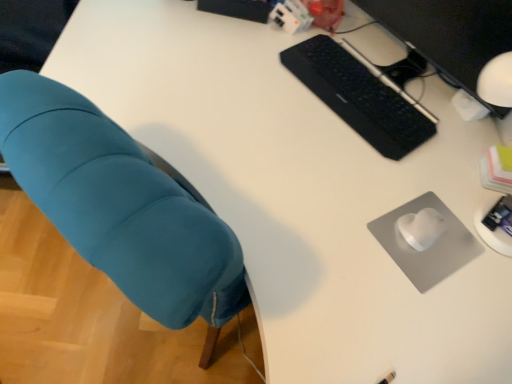
Question: Is black matte keyboard at upper right placed right next to black matte computer monitor at upper right?

Choices:
 (A) no
 (B) yes

Answer: (A)

Question: From the image's perspective, is black matte keyboard at upper right located above black matte computer monitor at upper right?

Choices:
 (A) yes
 (B) no

Answer: (B)

Question: Is black matte keyboard at upper right at the right side of black matte computer monitor at upper right?

Choices:
 (A) no
 (B) yes

Answer: (A)

Question: From the image's perspective, is black matte keyboard at upper right under black matte computer monitor at upper right?

Choices:
 (A) no
 (B) yes

Answer: (B)

Question: Is black matte keyboard at upper right oriented towards black matte computer monitor at upper right?

Choices:
 (A) no
 (B) yes

Answer: (A)

Question: Considering the relative sizes of black matte keyboard at upper right and black matte computer monitor at upper right in the image provided, is black matte keyboard at upper right wider than black matte computer monitor at upper right?

Choices:
 (A) yes
 (B) no

Answer: (A)

Question: Is black matte keyboard at upper right to the right of gray matte mousepad at lower right from the viewer's perspective?

Choices:
 (A) no
 (B) yes

Answer: (A)

Question: Can you confirm if black matte keyboard at upper right is thinner than gray matte mousepad at lower right?

Choices:
 (A) yes
 (B) no

Answer: (A)

Question: Is the surface of black matte keyboard at upper right in direct contact with gray matte mousepad at lower right?

Choices:
 (A) no
 (B) yes

Answer: (A)

Question: Is black matte keyboard at upper right outside of gray matte mousepad at lower right?

Choices:
 (A) yes
 (B) no

Answer: (A)

Question: From the image's perspective, is black matte keyboard at upper right below gray matte mousepad at lower right?

Choices:
 (A) no
 (B) yes

Answer: (A)

Question: From the image's perspective, would you say black matte keyboard at upper right is positioned over gray matte mousepad at lower right?

Choices:
 (A) no
 (B) yes

Answer: (B)

Question: Can you confirm if gray matte mousepad at lower right is wider than black matte keyboard at upper right?

Choices:
 (A) yes
 (B) no

Answer: (A)